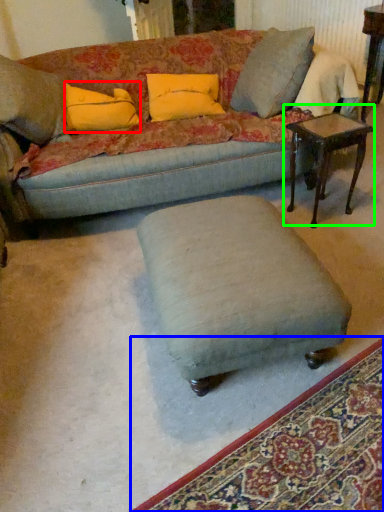
Question: Considering the real-world distances, which object is closest to pillow (highlighted by a red box)? mat (highlighted by a blue box) or table (highlighted by a green box).

Choices:
 (A) mat
 (B) table

Answer: (B)